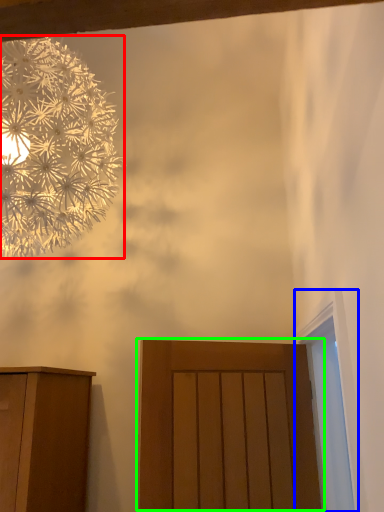
Question: Which object is the closest to the flower (highlighted by a red box)? Choose among these: window (highlighted by a blue box) or door (highlighted by a green box).

Choices:
 (A) window
 (B) door

Answer: (B)